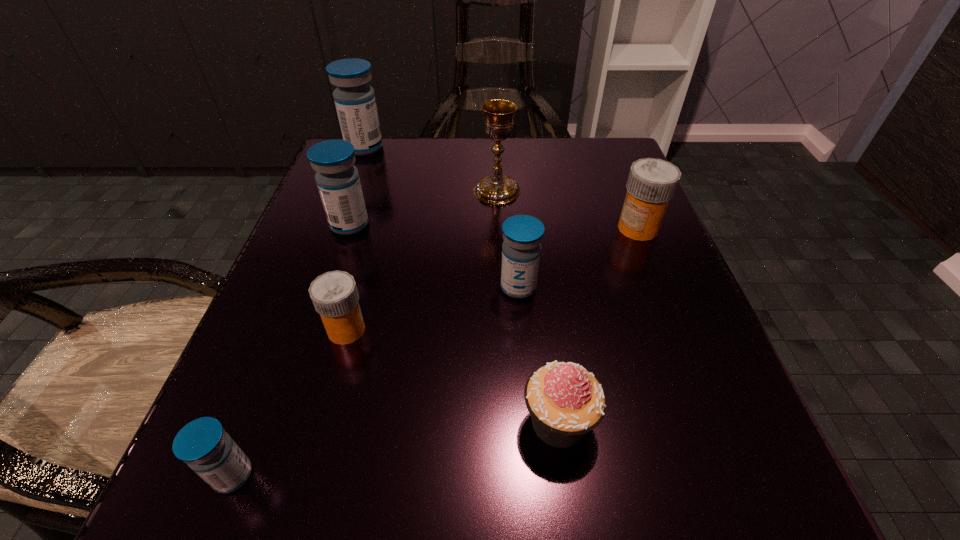
Where is `blue medicine that is the third nearest to the second tallest medicine`? blue medicine that is the third nearest to the second tallest medicine is located at coordinates (203, 444).

Where is `blue medicine object that ranks as the second closest to the nearer orange medicine`? The width and height of the screenshot is (960, 540). blue medicine object that ranks as the second closest to the nearer orange medicine is located at coordinates (338, 181).

Image resolution: width=960 pixels, height=540 pixels. I want to click on vacant area in the image that satisfies the following two spatial constraints: 1. on the back side of the nearest medicine; 2. on the left side of the chalice, so click(343, 191).

Locate an element on the screen. The image size is (960, 540). vacant area that satisfies the following two spatial constraints: 1. on the front side of the cupcake; 2. on the right side of the chalice is located at coordinates (508, 422).

I want to click on free spot that satisfies the following two spatial constraints: 1. on the front side of the biggest blue medicine; 2. on the right side of the pink cupcake, so click(x=263, y=422).